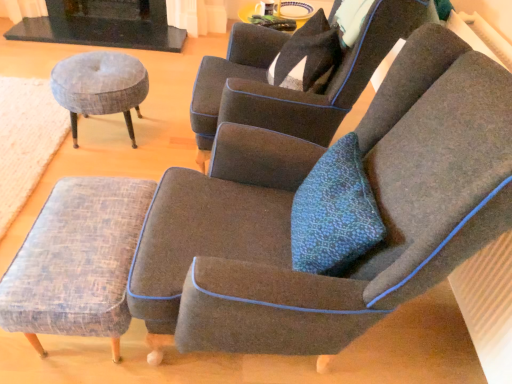
You are a GUI agent. You are given a task and a screenshot of the screen. Output one action in this format:
    pyautogui.click(x=<x>, y=<y>)
    Task: Click on the free point above textured gray stool at lower left, marked as the second stool in a top-to-bottom arrangement (from a real-world perspective)
    The image size is (512, 384).
    Given the screenshot: What is the action you would take?
    pyautogui.click(x=81, y=230)